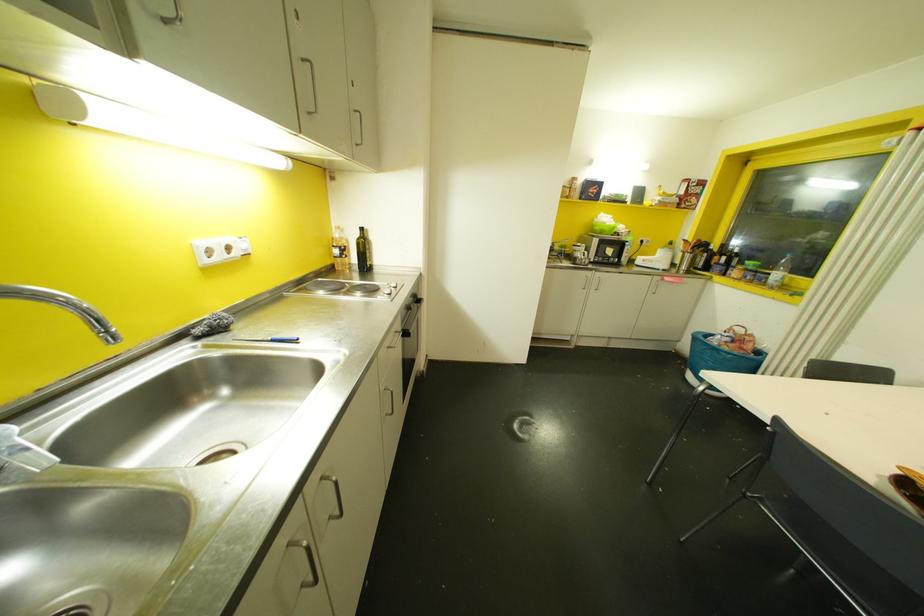
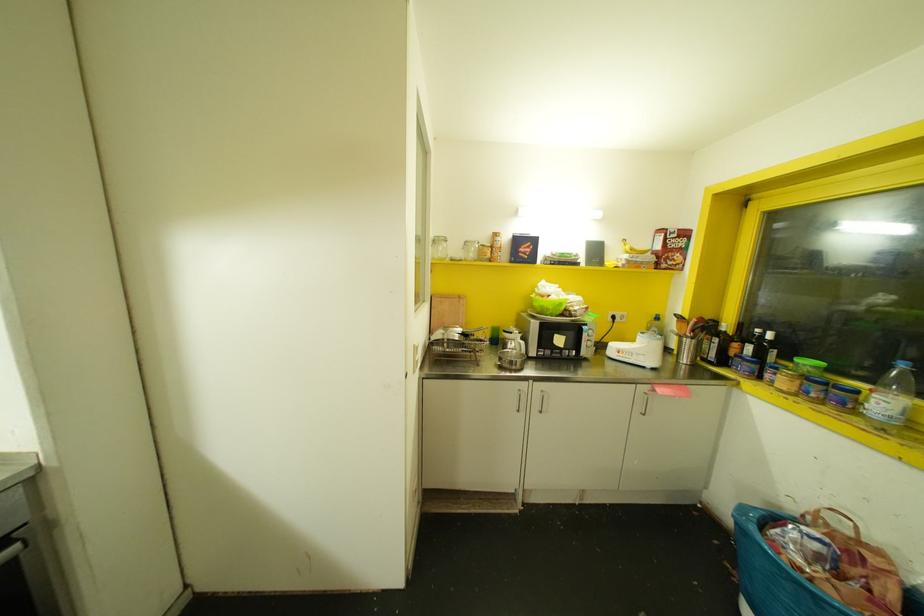
The point at (613, 227) is marked in the first image. Where is the corresponding point in the second image?

(560, 304)